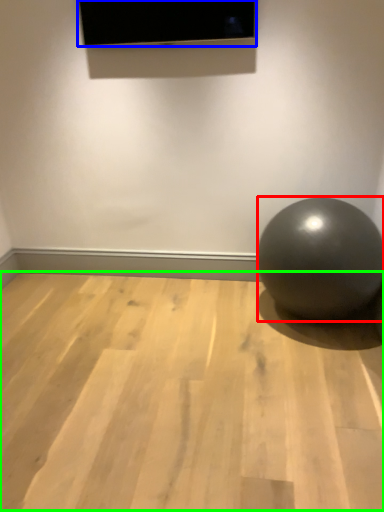
Question: Which object is the closest to the ball (highlighted by a red box)? Choose among these: projection screen (highlighted by a blue box) or surface (highlighted by a green box).

Choices:
 (A) projection screen
 (B) surface

Answer: (B)